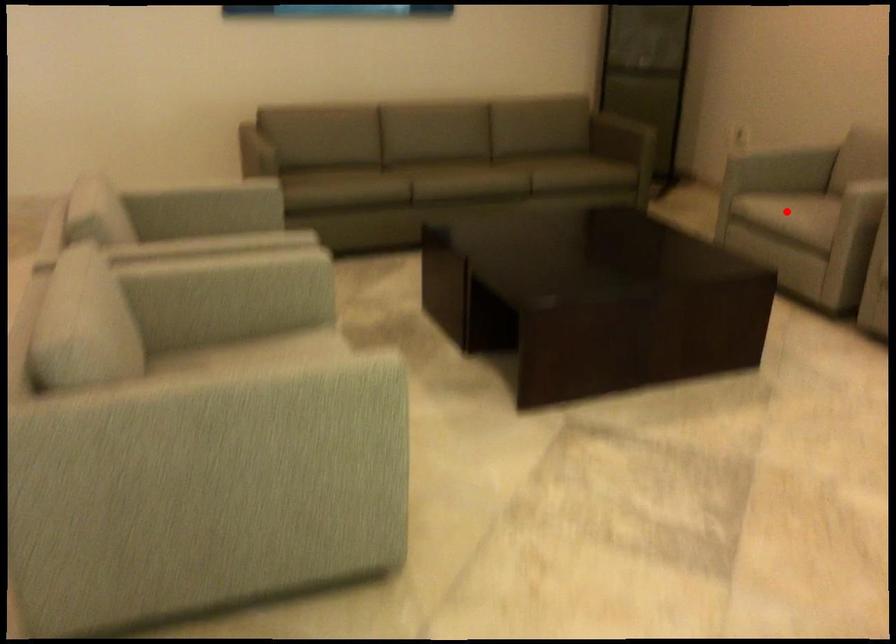
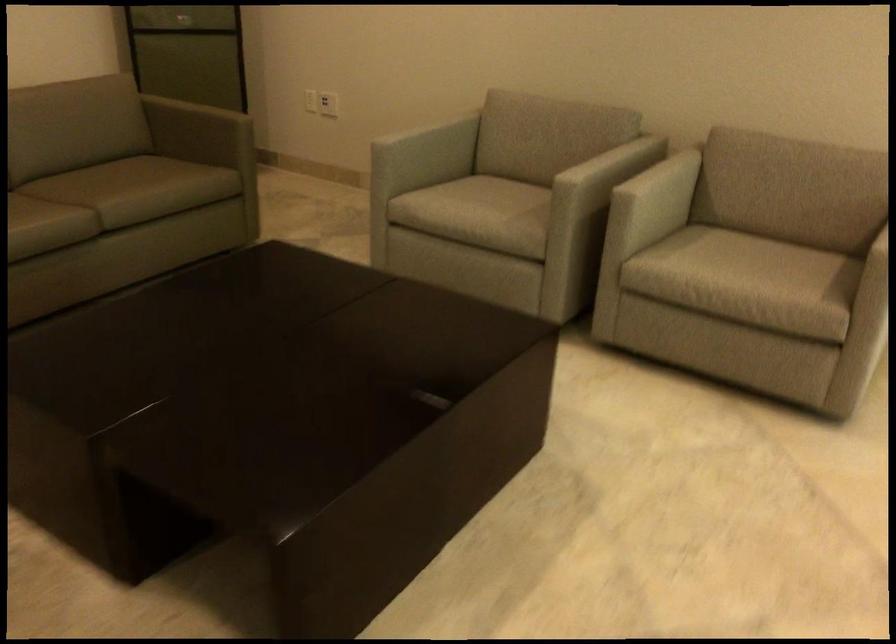
In the second image, find the point that corresponds to the highlighted location in the first image.

(480, 207)